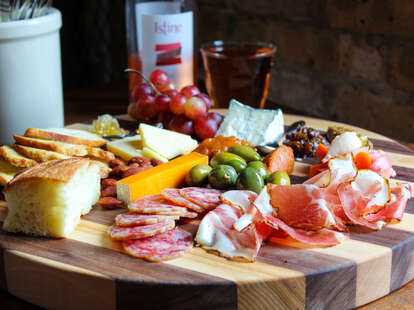
Identify the location of wine bottle. This screenshot has width=414, height=310. (164, 56).